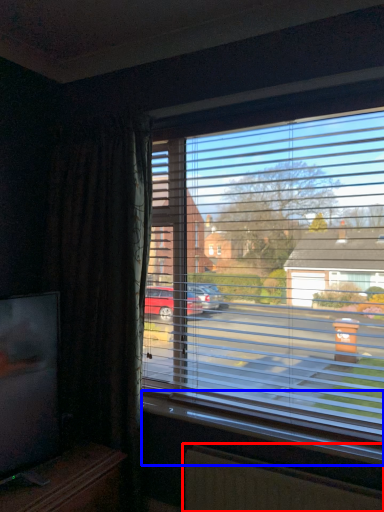
Question: Among these objects, which one is nearest to the camera, radiator (highlighted by a red box) or window sill (highlighted by a blue box)?

Choices:
 (A) radiator
 (B) window sill

Answer: (A)